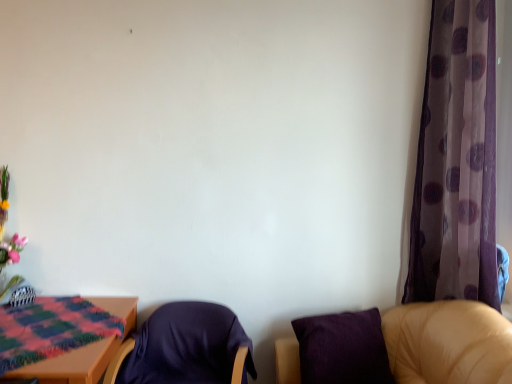
Question: Is purple fabric chair at lower right, the 1th chair from the right, oriented towards dark blue fabric chair at center, marked as the 1th chair in a left-to-right arrangement?

Choices:
 (A) no
 (B) yes

Answer: (B)

Question: Does purple fabric chair at lower right, the 1th chair from the right, have a larger size compared to dark blue fabric chair at center, marked as the 1th chair in a left-to-right arrangement?

Choices:
 (A) yes
 (B) no

Answer: (A)

Question: Does purple fabric chair at lower right, the second chair viewed from the left, have a greater width compared to dark blue fabric chair at center, marked as the 1th chair in a left-to-right arrangement?

Choices:
 (A) yes
 (B) no

Answer: (A)

Question: From the image's perspective, would you say purple fabric chair at lower right, the 1th chair from the right, is positioned over dark blue fabric chair at center, which appears as the 2th chair when viewed from the right?

Choices:
 (A) no
 (B) yes

Answer: (B)

Question: Is purple fabric chair at lower right, the second chair viewed from the left, not inside dark blue fabric chair at center, which appears as the 2th chair when viewed from the right?

Choices:
 (A) yes
 (B) no

Answer: (A)

Question: Which is correct: dark blue fabric chair at center, which appears as the 2th chair when viewed from the right, is inside purple fabric chair at lower right, the 1th chair from the right, or outside of it?

Choices:
 (A) inside
 (B) outside

Answer: (B)

Question: Looking at the image, does dark blue fabric chair at center, which appears as the 2th chair when viewed from the right, seem bigger or smaller compared to purple fabric chair at lower right, the 1th chair from the right?

Choices:
 (A) big
 (B) small

Answer: (B)

Question: In the image, is dark blue fabric chair at center, marked as the 1th chair in a left-to-right arrangement, on the left side or the right side of purple fabric chair at lower right, the 1th chair from the right?

Choices:
 (A) left
 (B) right

Answer: (A)

Question: Is point (114, 357) closer or farther from the camera than point (445, 302)?

Choices:
 (A) farther
 (B) closer

Answer: (B)

Question: Considering the positions of point (500, 339) and point (34, 369), is point (500, 339) closer or farther from the camera than point (34, 369)?

Choices:
 (A) closer
 (B) farther

Answer: (B)

Question: Considering their positions, is purple fabric chair at lower right, the second chair viewed from the left, located in front of or behind wooden table at lower left?

Choices:
 (A) behind
 (B) front

Answer: (B)

Question: From the image's perspective, is purple fabric chair at lower right, the 1th chair from the right, located above or below wooden table at lower left?

Choices:
 (A) above
 (B) below

Answer: (B)

Question: From their relative heights in the image, would you say purple fabric chair at lower right, the 1th chair from the right, is taller or shorter than wooden table at lower left?

Choices:
 (A) short
 (B) tall

Answer: (B)

Question: In the image, is transparent purple curtain at right on the left side or the right side of purple fabric chair at lower right, the second chair viewed from the left?

Choices:
 (A) left
 (B) right

Answer: (B)

Question: Is point click(x=441, y=36) closer or farther from the camera than point click(x=492, y=317)?

Choices:
 (A) farther
 (B) closer

Answer: (A)